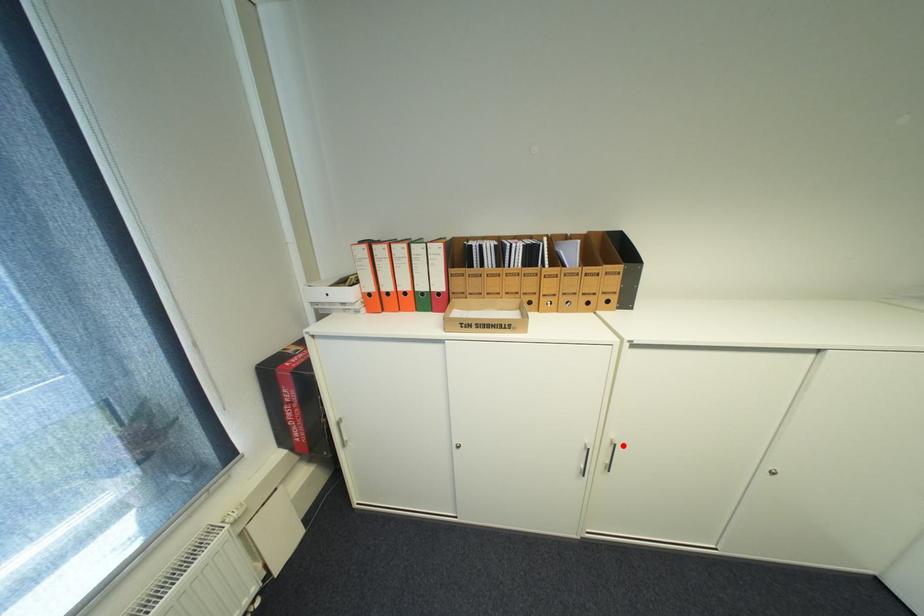
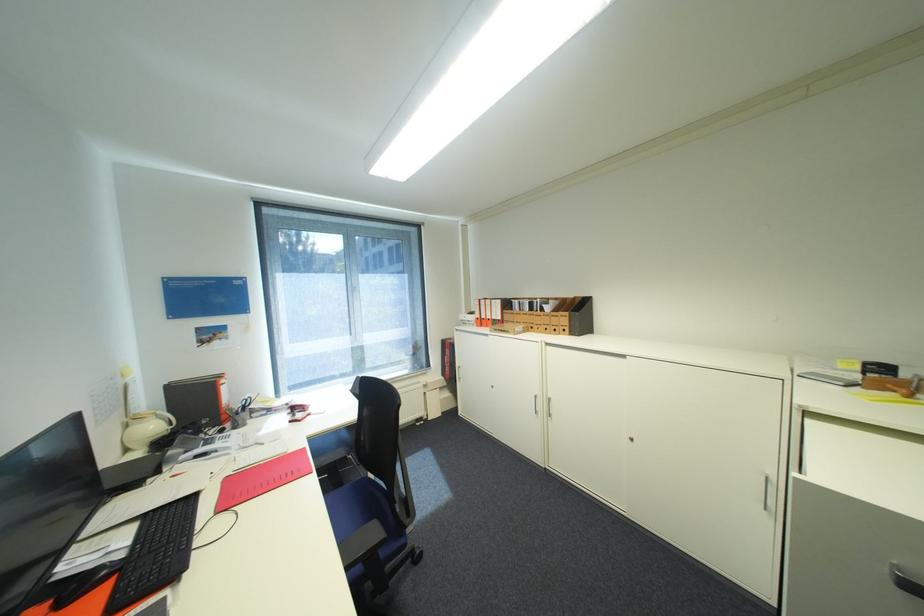
Where in the second image is the point corresponding to the highlighted location from the first image?

(556, 400)